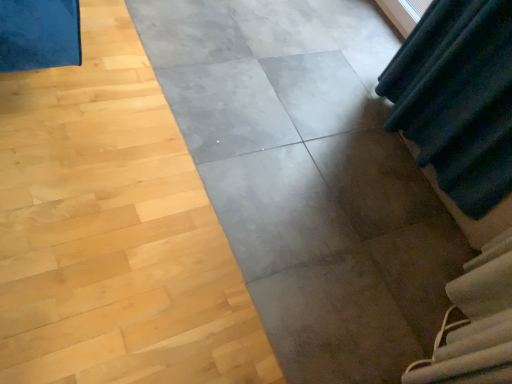
Locate an element on the screen. gray concrete at center is located at coordinates (309, 178).

What do you see at coordinates (309, 178) in the screenshot? I see `gray concrete at center` at bounding box center [309, 178].

Locate an element on the screen. This screenshot has width=512, height=384. white fabric at lower right is located at coordinates (475, 324).

Describe the element at coordinates (475, 324) in the screenshot. The width and height of the screenshot is (512, 384). I see `white fabric at lower right` at that location.

What is the approximate width of white fabric at lower right?

white fabric at lower right is 7.60 inches in width.

Locate an element on the screen. This screenshot has width=512, height=384. gray concrete at center is located at coordinates (309, 178).

Considering the positions of objects white fabric at lower right and gray concrete at center in the image provided, who is more to the left, white fabric at lower right or gray concrete at center?

gray concrete at center is more to the left.

Considering the positions of objects white fabric at lower right and gray concrete at center in the image provided, who is in front, white fabric at lower right or gray concrete at center?

gray concrete at center is in front.

Is point (508, 248) positioned behind point (204, 36)?

No, (508, 248) is closer to viewer.

From the image's perspective, does white fabric at lower right appear lower than gray concrete at center?

Correct, white fabric at lower right appears lower than gray concrete at center in the image.

From a real-world perspective, between white fabric at lower right and gray concrete at center, who is vertically lower?

gray concrete at center.

Considering the relative sizes of white fabric at lower right and gray concrete at center in the image provided, is white fabric at lower right wider than gray concrete at center?

No, white fabric at lower right is not wider than gray concrete at center.

Considering the sizes of white fabric at lower right and gray concrete at center in the image, is white fabric at lower right taller or shorter than gray concrete at center?

Clearly, white fabric at lower right is taller compared to gray concrete at center.

Which of these two, white fabric at lower right or gray concrete at center, is bigger?

Bigger between the two is gray concrete at center.

Would you say white fabric at lower right is outside gray concrete at center?

Yes, white fabric at lower right is not within gray concrete at center.

Are white fabric at lower right and gray concrete at center located far from each other?

They are positioned close to each other.

Is white fabric at lower right oriented away from gray concrete at center?

white fabric at lower right is not turned away from gray concrete at center.

How different are the orientations of white fabric at lower right and gray concrete at center in degrees?

There is a 29.2-degree angle between the facing directions of white fabric at lower right and gray concrete at center.

In order to click on stairwell behind the gray concrete at center in this screenshot , I will do `click(475, 324)`.

Which is more to the left, gray concrete at center or white fabric at lower right?

gray concrete at center.

Is gray concrete at center positioned behind white fabric at lower right?

No, it is in front of white fabric at lower right.

Considering the positions of points (424, 327) and (443, 343), is point (424, 327) closer to camera compared to point (443, 343)?

That is False.

From the image's perspective, relative to white fabric at lower right, is gray concrete at center above or below?

Based on their image positions, gray concrete at center is located above white fabric at lower right.

From a real-world perspective, which is physically above, gray concrete at center or white fabric at lower right?

white fabric at lower right, from a real-world perspective.

Based on the photo, in terms of width, does gray concrete at center look wider or thinner when compared to white fabric at lower right?

gray concrete at center is wider than white fabric at lower right.

From their relative heights in the image, would you say gray concrete at center is taller or shorter than white fabric at lower right?

Considering their sizes, gray concrete at center has less height than white fabric at lower right.

In the scene shown: Who is smaller, gray concrete at center or white fabric at lower right?

Smaller between the two is white fabric at lower right.

Is white fabric at lower right surrounded by gray concrete at center?

Actually, white fabric at lower right is outside gray concrete at center.

Is gray concrete at center touching white fabric at lower right?

They are not placed beside each other.

Is gray concrete at center positioned with its back to white fabric at lower right?

gray concrete at center does not have its back to white fabric at lower right.

You are a GUI agent. You are given a task and a screenshot of the screen. Output one action in this format:
    pyautogui.click(x=<x>, y=<y>)
    Task: Click on the concrete located in front of the white fabric at lower right
    The height and width of the screenshot is (384, 512).
    Given the screenshot: What is the action you would take?
    pyautogui.click(x=309, y=178)

In the image, there is a white fabric at lower right. At what (x,y) coordinates should I click in order to perform the action: click on concrete above it (from the image's perspective). Please return your answer as a coordinate pair (x, y). This screenshot has height=384, width=512. Looking at the image, I should click on (309, 178).

Identify the location of stairwell that is on the right side of gray concrete at center. (475, 324).